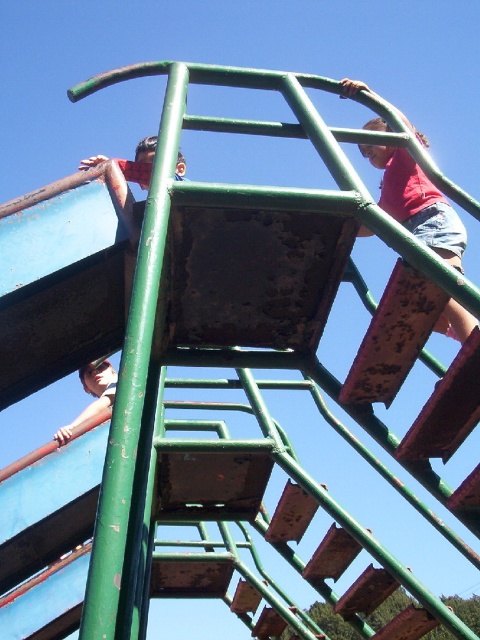
Consider the image. You are standing at the base of the playground structure and see the point marked as point (x=417, y=202). Which child is located at that point?

The point (x=417, y=202) corresponds to the matte red shirt at upper right, so the child wearing the matte red shirt at upper right is located at that point.

You are a parent supervising children at the playground. You notice the matte red shirt at upper right and the matte green ladder at lower left. Which object is higher in the image?

The matte red shirt at upper right is much taller than the matte green ladder at lower left, so the matte red shirt at upper right is higher in the image.

You are a parent at the playground and want to ensure your child can see the slide clearly. The slide is located near the matte green ladder at lower left. Considering the size of the matte red shirt at upper right, do you think it might block the view of the slide from where the ladder is?

The matte red shirt at upper right is bigger than the matte green ladder at lower left. Since the shirt is larger, it could potentially block the view of the slide from the ladder area.